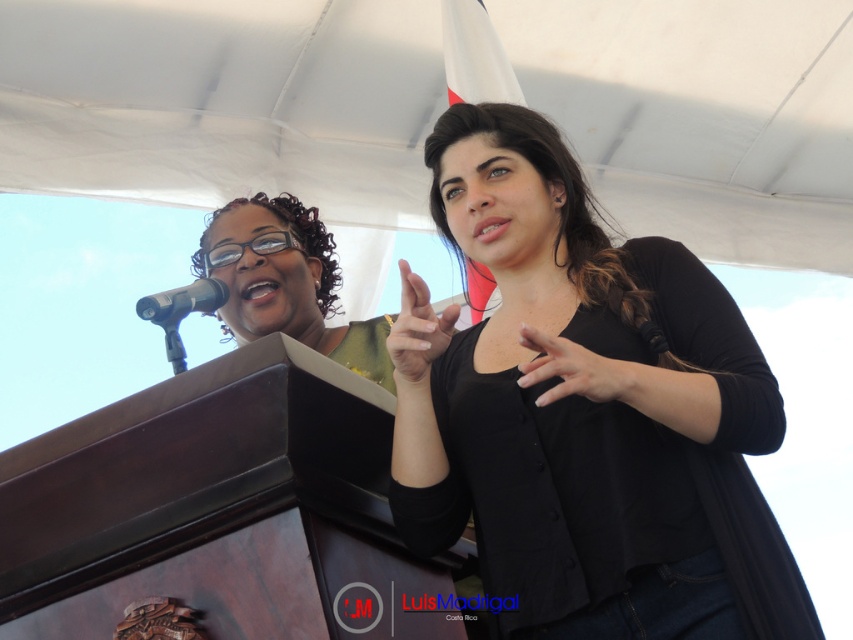
You are a photographer at the event and want to capture a closeup of the nail polish at center and the matte black hand at center. Given that your camera has a fixed focus range that can only clearly capture objects up to 5 cm in size, will both items be in focus?

The nail polish at center is smaller than the matte black hand at center. Since the camera can only focus on objects up to 5 cm in size, the nail polish at center will be in focus, but the matte black hand at center may be too large to be clearly captured. Adjust your position or equipment accordingly.

You are a photographer at the event and need to ensure both the matte black shirt at upper center and the matte black hand at center are clearly visible in your photo. Given their sizes, which one might you need to adjust your focus on to ensure clarity?

The matte black hand at center is smaller in size compared to the matte black shirt at upper center, so you might need to adjust focus on the matte black hand at center to ensure clarity.